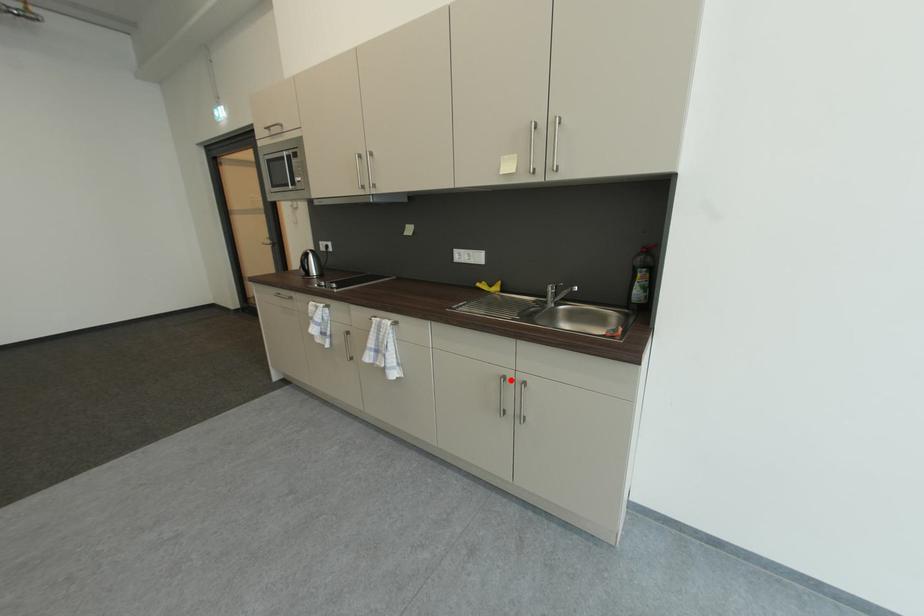
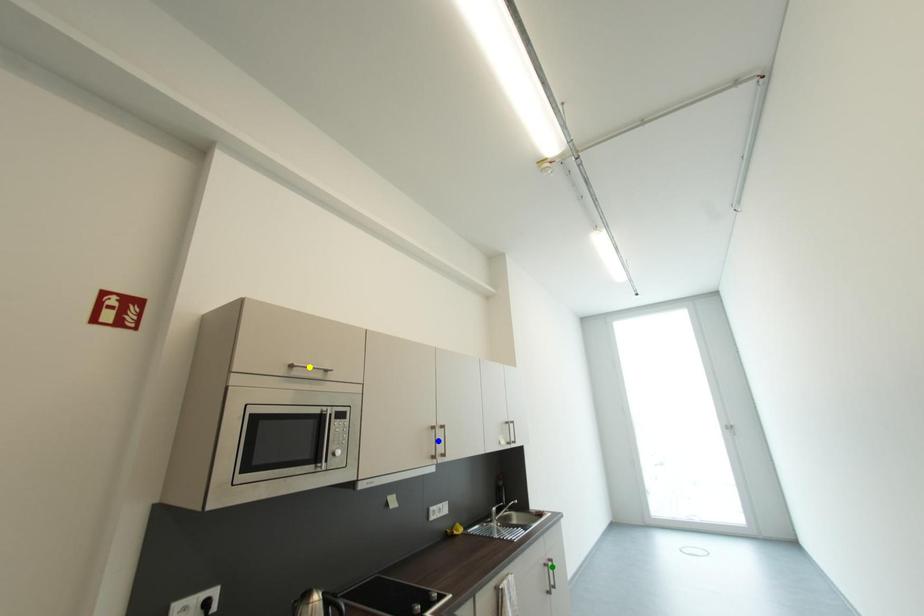
Question: I am providing you with two images of the same scene from different viewpoints. A red point is marked on the first image. You are given multiple points on the second image. Can you choose the point in image 2 that corresponds to the point in image 1?

Choices:
 (A) yellow point
 (B) green point
 (C) blue point

Answer: (B)